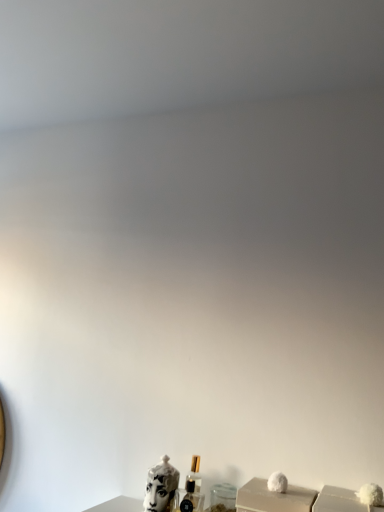
Question: From the image's perspective, is white matte box at lower right located above white glossy sculpture at lower center?

Choices:
 (A) no
 (B) yes

Answer: (A)

Question: Is white matte box at lower right taller than white glossy sculpture at lower center?

Choices:
 (A) yes
 (B) no

Answer: (A)

Question: Can you confirm if white matte box at lower right is wider than white glossy sculpture at lower center?

Choices:
 (A) no
 (B) yes

Answer: (B)

Question: From the image's perspective, is white matte box at lower right under white glossy sculpture at lower center?

Choices:
 (A) no
 (B) yes

Answer: (B)

Question: Is white matte box at lower right next to white glossy sculpture at lower center and touching it?

Choices:
 (A) no
 (B) yes

Answer: (A)

Question: From a real-world perspective, does white matte box at lower right sit lower than white glossy sculpture at lower center?

Choices:
 (A) no
 (B) yes

Answer: (A)

Question: Is clear glass perfume at center oriented away from white matte box at lower right?

Choices:
 (A) no
 (B) yes

Answer: (A)

Question: Considering the relative sizes of clear glass perfume at center and white matte box at lower right in the image provided, is clear glass perfume at center thinner than white matte box at lower right?

Choices:
 (A) no
 (B) yes

Answer: (B)

Question: Is clear glass perfume at center aimed at white matte box at lower right?

Choices:
 (A) yes
 (B) no

Answer: (B)

Question: Is clear glass perfume at center at the right side of white matte box at lower right?

Choices:
 (A) yes
 (B) no

Answer: (B)

Question: Considering the relative sizes of clear glass perfume at center and white matte box at lower right in the image provided, is clear glass perfume at center bigger than white matte box at lower right?

Choices:
 (A) yes
 (B) no

Answer: (B)

Question: From a real-world perspective, does clear glass perfume at center stand above white matte box at lower right?

Choices:
 (A) no
 (B) yes

Answer: (A)

Question: Is clear glass perfume at center positioned with its back to white glossy sculpture at lower center?

Choices:
 (A) yes
 (B) no

Answer: (B)